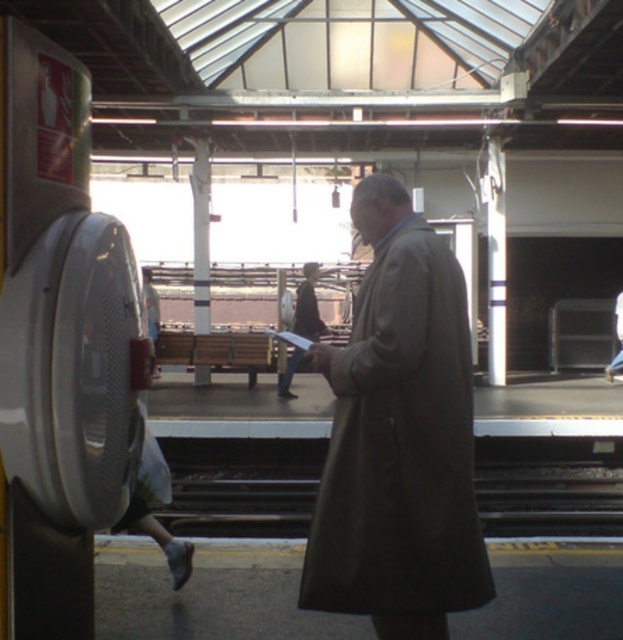
In the scene shown: You are standing at the train station platform and want to take a photo of the point at coordinates (445,605). Your camera has a maximum focus range of 3.5 meters. Will the point be in focus?

The distance of point (445,605) from the camera is 3.48 meters, which is within the camera maximum focus range of 3.5 meters. Therefore, the point will be in focus.

You are a passenger waiting at the train station platform. You see a brown matte trench coat at center and a dark gray metal train track at center. Which object is positioned to the right side of the platform?

The brown matte trench coat at center is positioned to the right of the dark gray metal train track at center, so the brown matte trench coat at center is on the right side of the platform.

You are a photographer standing at the train station platform. You want to take a photo of the dark gray metal train track at center and the light brown leather coat at center. Which object should you focus on first if you want to capture both in sharp focus?

The dark gray metal train track at center is closer to the viewer than the light brown leather coat at center. To capture both in sharp focus, you should focus on the dark gray metal train track at center first, as it is closer, and adjust the depth of field accordingly.